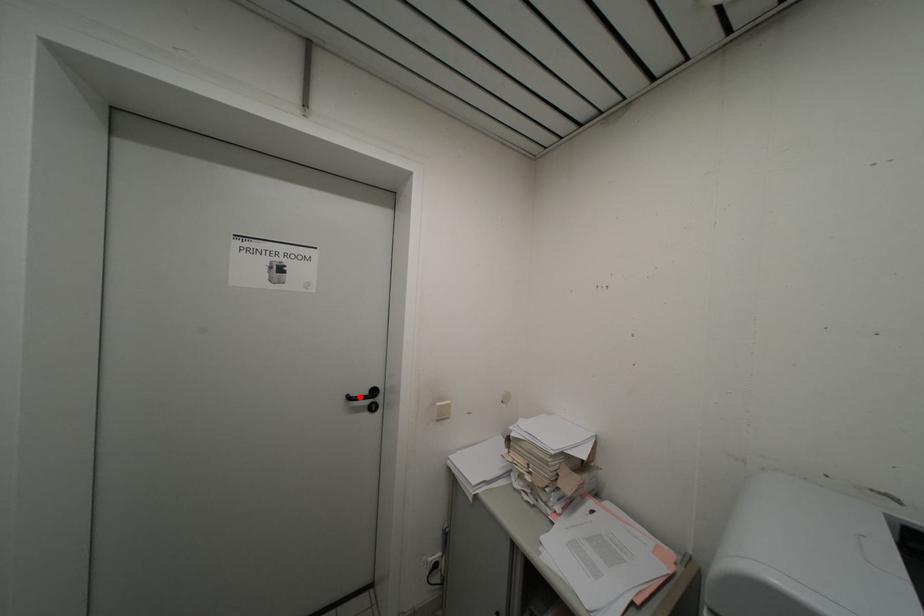
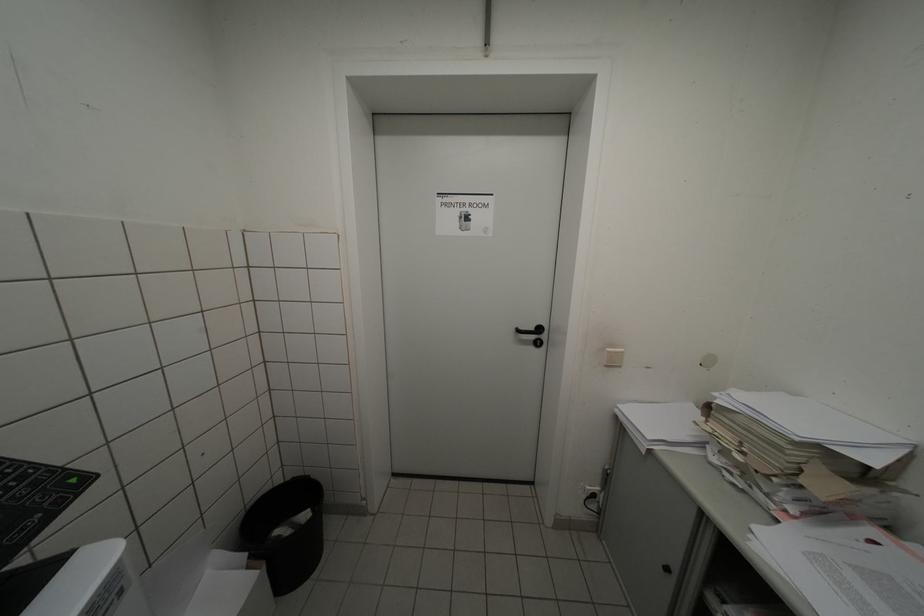
Locate, in the second image, the point that corresponds to the highlighted location in the first image.

(529, 331)